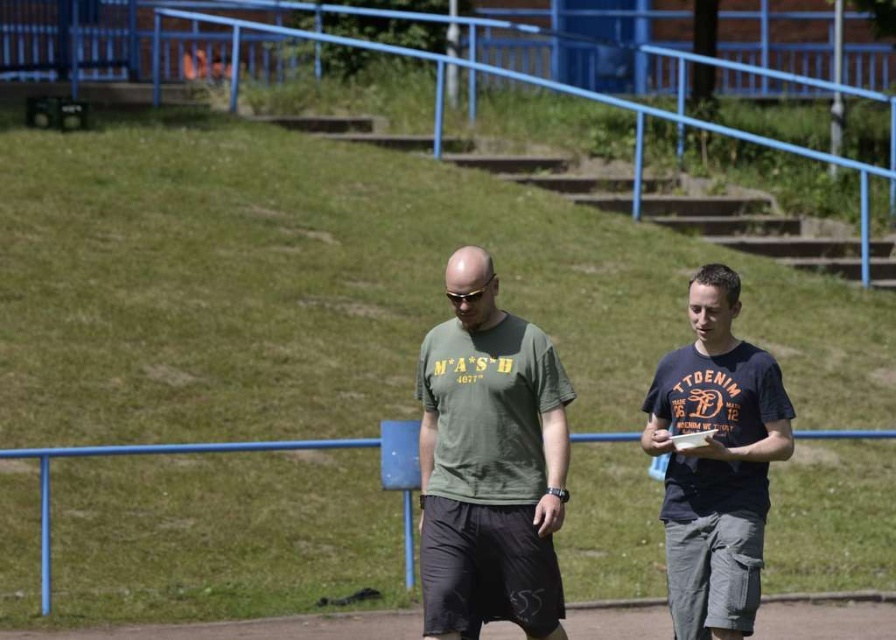
Question: Can you confirm if green matte t-shirt at center is positioned to the left of black matte sunglasses at center?

Choices:
 (A) yes
 (B) no

Answer: (B)

Question: Is blue metal rail at center in front of black matte sunglasses at center?

Choices:
 (A) no
 (B) yes

Answer: (A)

Question: Does green cotton t-shirt at center appear on the right side of dark blue cotton t-shirt at right?

Choices:
 (A) no
 (B) yes

Answer: (A)

Question: Which point appears closest to the camera in this image?

Choices:
 (A) [x=722, y=403]
 (B) [x=390, y=438]
 (C) [x=466, y=296]
 (D) [x=553, y=380]

Answer: (C)

Question: Among these points, which one is nearest to the camera?

Choices:
 (A) (487, 285)
 (B) (713, 605)
 (C) (50, 579)

Answer: (B)

Question: Which point is farther to the camera?

Choices:
 (A) blue metal rail at center
 (B) green cotton t-shirt at center

Answer: (A)